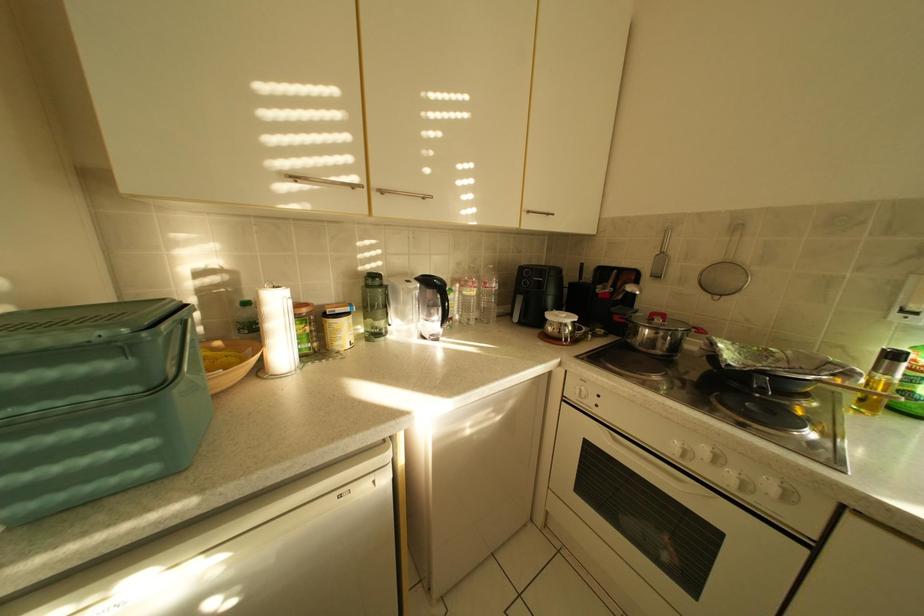
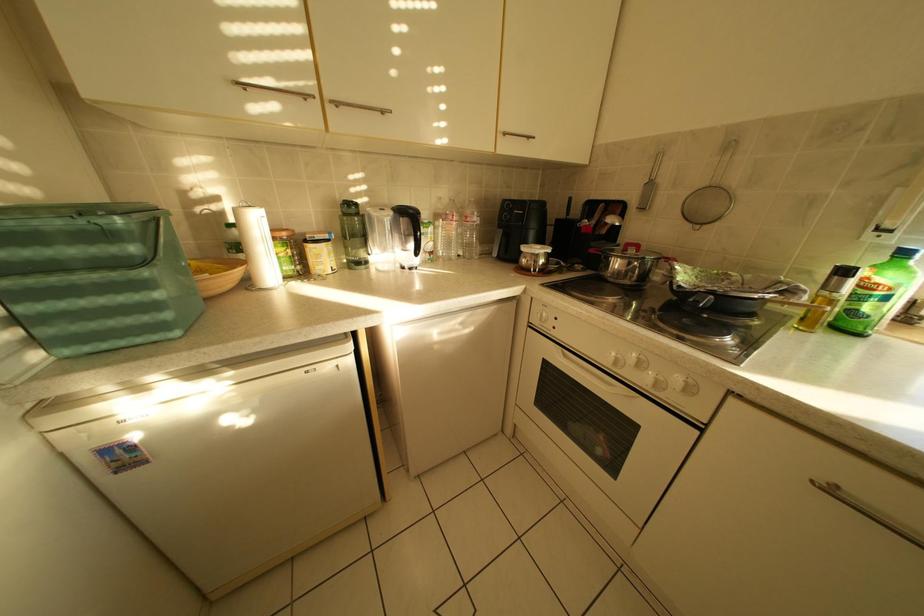
Question: The first image is from the beginning of the video and the second image is from the end. How did the camera likely rotate when shooting the video?

Choices:
 (A) Left
 (B) Right
 (C) Up
 (D) Down

Answer: (D)